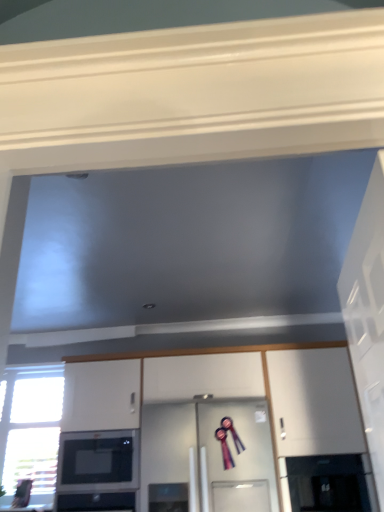
Question: Would you say clear glass window at lower left contains black glossy microwave at lower left?

Choices:
 (A) no
 (B) yes

Answer: (A)

Question: Is clear glass window at lower left not inside black glossy microwave at lower left?

Choices:
 (A) yes
 (B) no

Answer: (A)

Question: Is clear glass window at lower left bigger than black glossy microwave at lower left?

Choices:
 (A) yes
 (B) no

Answer: (A)

Question: Considering the relative sizes of clear glass window at lower left and black glossy microwave at lower left in the image provided, is clear glass window at lower left smaller than black glossy microwave at lower left?

Choices:
 (A) no
 (B) yes

Answer: (A)

Question: Is clear glass window at lower left next to black glossy microwave at lower left and touching it?

Choices:
 (A) no
 (B) yes

Answer: (A)

Question: Is clear glass window at lower left thinner than black glossy microwave at lower left?

Choices:
 (A) yes
 (B) no

Answer: (A)

Question: From the image's perspective, does white glossy door at right appear higher than clear glass door at center, which is the 2th glass door from right to left?

Choices:
 (A) no
 (B) yes

Answer: (B)

Question: Considering the relative sizes of white glossy door at right and clear glass door at center, which is the 2th glass door from right to left, in the image provided, is white glossy door at right wider than clear glass door at center, which is the 2th glass door from right to left,?

Choices:
 (A) no
 (B) yes

Answer: (A)

Question: From a real-world perspective, is white glossy door at right located beneath clear glass door at center, which is the 2th glass door from right to left?

Choices:
 (A) no
 (B) yes

Answer: (A)

Question: Is white glossy door at right placed right next to clear glass door at center, arranged as the first glass door when viewed from the left?

Choices:
 (A) yes
 (B) no

Answer: (B)

Question: From the image's perspective, is white glossy door at right beneath clear glass door at center, arranged as the first glass door when viewed from the left?

Choices:
 (A) yes
 (B) no

Answer: (B)

Question: Is clear glass door at center, arranged as the first glass door when viewed from the left, surrounded by white glossy door at right?

Choices:
 (A) no
 (B) yes

Answer: (A)

Question: Is white glossy door at right next to transparent glass door at lower right, marked as the first glass door in a right-to-left arrangement, and touching it?

Choices:
 (A) no
 (B) yes

Answer: (A)